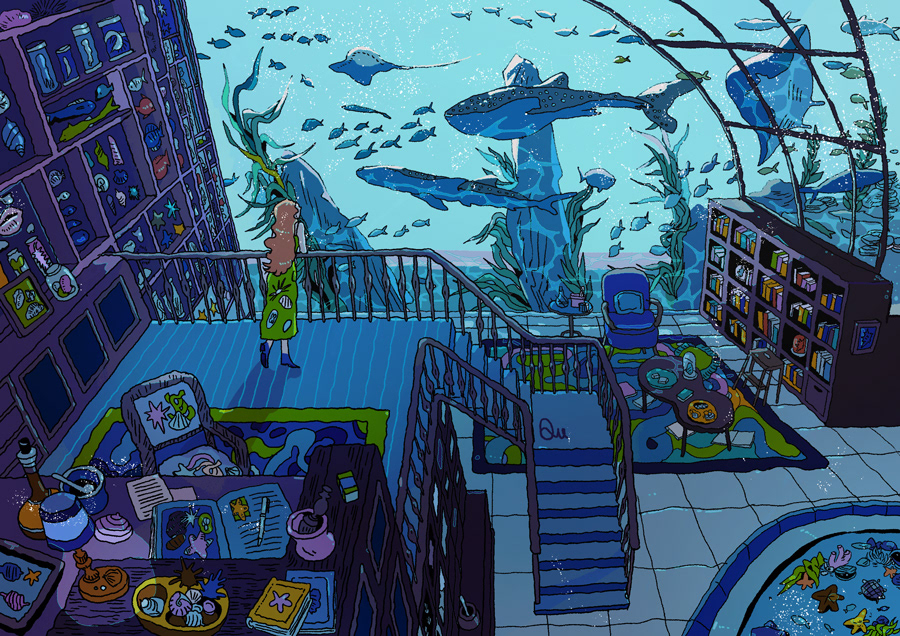
What are the coordinates of `rugs` in the screenshot? It's located at (639, 402), (876, 546), (263, 422).